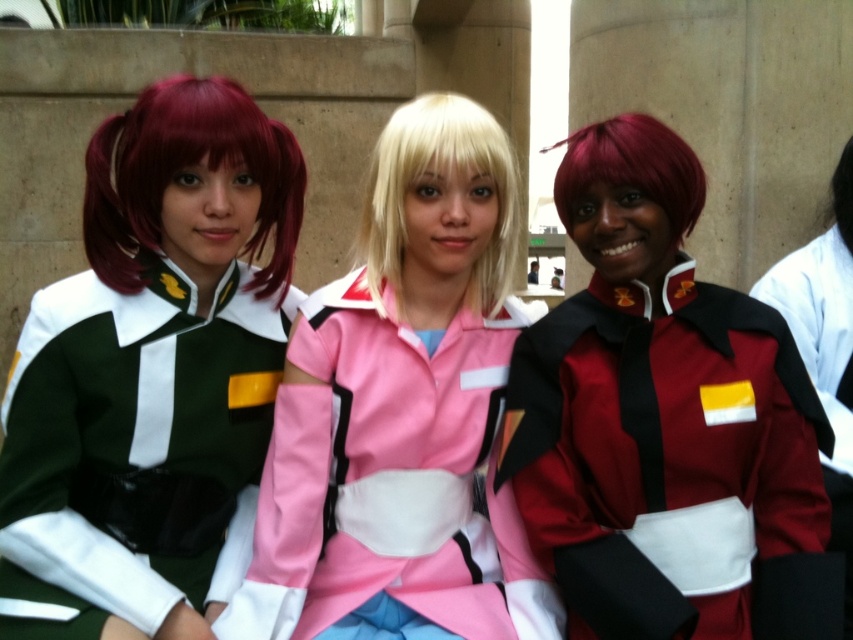
Question: Where is matte green uniform at left located in relation to matte black jacket at center in the image?

Choices:
 (A) above
 (B) below

Answer: (A)

Question: Which is nearer to the blonde silky hair at center?

Choices:
 (A) matte black jacket at center
 (B) matte green uniform at left
 (C) black silky hair at center

Answer: (B)

Question: Which point appears farthest from the camera in this image?

Choices:
 (A) (641, 129)
 (B) (840, 164)

Answer: (B)

Question: Is matte red uniform at center wider than black silky hair at center?

Choices:
 (A) yes
 (B) no

Answer: (A)

Question: Considering the real-world distances, which object is farthest from the black silky hair at center?

Choices:
 (A) shiny burgundy wig at center
 (B) matte green uniform at left

Answer: (B)

Question: Is matte red uniform at center thinner than blonde silky hair at center?

Choices:
 (A) yes
 (B) no

Answer: (B)